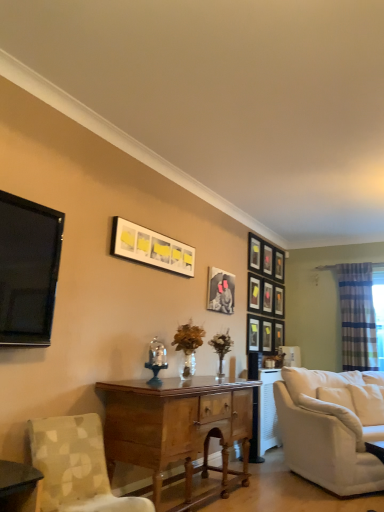
I want to click on vacant point above matte black picture frame at upper center, which appears as the first picture frame when viewed from the left (from a real-world perspective), so click(x=157, y=234).